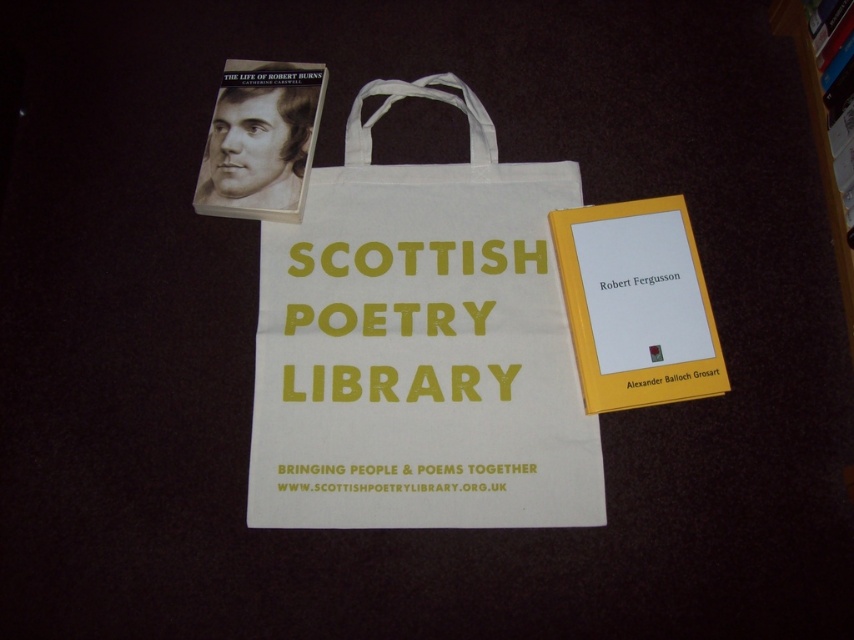
You are designing a layout for a poster and want to place the yellow printed text at center and the matte paper book at upper left. Based on their sizes, which object should you place first to ensure proper alignment?

The yellow printed text at center is shorter than the matte paper book at upper left, so you should place the matte paper book at upper left first to ensure proper alignment.

You have a white cotton tote bag at center and a hardcover book at upper center. Which object has a greater width?

The white cotton tote bag at center has a greater width than the hardcover book at upper center.